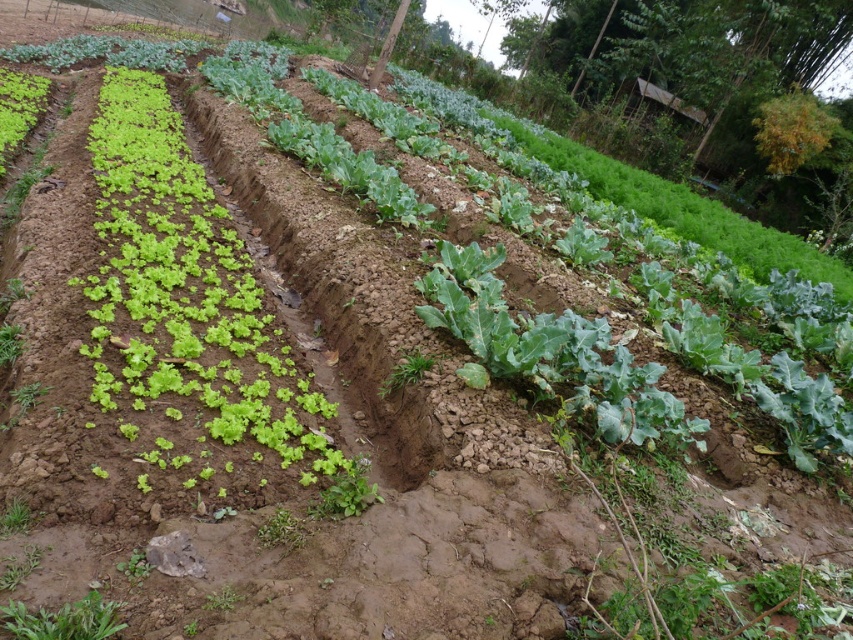
Question: Where is green leafy at lower left located in relation to green leafy at center in the image?

Choices:
 (A) above
 (B) below

Answer: (A)

Question: Can you confirm if green leafy lettuce at left is positioned to the left of green leafy at center?

Choices:
 (A) yes
 (B) no

Answer: (A)

Question: In this image, where is green leafy lettuce at left located relative to green leafy at center?

Choices:
 (A) above
 (B) below

Answer: (A)

Question: Considering the real-world distances, which object is farthest from the green leafy at lower left?

Choices:
 (A) green leafy at center
 (B) green leafy lettuce at left

Answer: (B)

Question: Estimate the real-world distances between objects in this image. Which object is farther from the green leafy lettuce at left?

Choices:
 (A) green leafy at center
 (B) green leafy at lower left

Answer: (A)

Question: Which of the following is the closest to the observer?

Choices:
 (A) green leafy lettuce at left
 (B) green leafy at lower left
 (C) green leafy at center

Answer: (B)